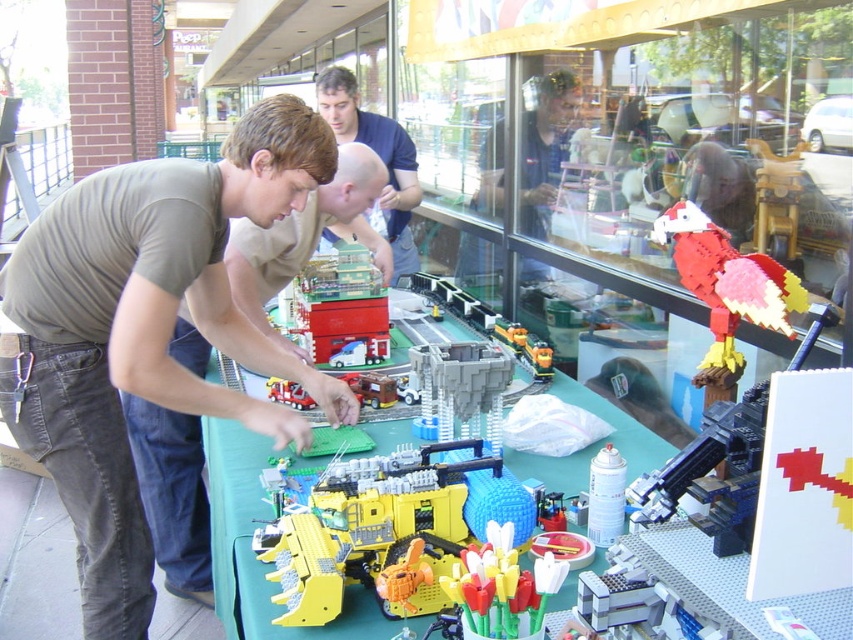
You are standing in front of the LEGO display and want to place a small sticker exactly at point (379, 157). According to the scene, where should you place the sticker?

The point (379, 157) is on the blue shirt at upper center, so you should place the sticker there.

You are a photographer trying to capture the LEGO set and the people interacting with it. You want to ensure both the red plastic fire truck at center and the blue shirt at upper center are clearly visible in your photo. Considering their sizes, which object should you focus on first to ensure proper focus?

The blue shirt at upper center has a larger size compared to the red plastic fire truck at center, so you should focus on the blue shirt at upper center first to ensure proper focus since it is larger and might require more precise focusing.